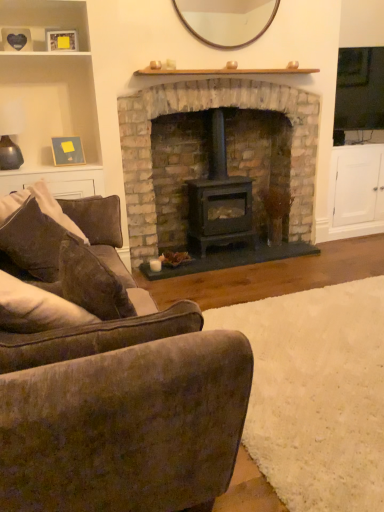
Question: Does velvety brown armchair at lower left have a larger size compared to wooden mirror at upper center?

Choices:
 (A) yes
 (B) no

Answer: (A)

Question: Are velvety brown armchair at lower left and wooden mirror at upper center making contact?

Choices:
 (A) no
 (B) yes

Answer: (A)

Question: Does velvety brown armchair at lower left turn towards wooden mirror at upper center?

Choices:
 (A) yes
 (B) no

Answer: (B)

Question: Would you say velvety brown armchair at lower left is a long distance from wooden mirror at upper center?

Choices:
 (A) no
 (B) yes

Answer: (B)

Question: Can you confirm if velvety brown armchair at lower left is shorter than wooden mirror at upper center?

Choices:
 (A) yes
 (B) no

Answer: (A)

Question: In the image, is brown fabric pillow at left positioned in front of or behind velvety brown armchair at lower left?

Choices:
 (A) behind
 (B) front

Answer: (A)

Question: From a real-world perspective, is brown fabric pillow at left physically located above or below velvety brown armchair at lower left?

Choices:
 (A) above
 (B) below

Answer: (A)

Question: Is brown fabric pillow at left taller or shorter than velvety brown armchair at lower left?

Choices:
 (A) short
 (B) tall

Answer: (B)

Question: Would you say brown fabric pillow at left is to the left or to the right of velvety brown armchair at lower left in the picture?

Choices:
 (A) left
 (B) right

Answer: (A)

Question: In the image, is wooden picture frame at upper left, arranged as the 2th picture frame when viewed from the back, positioned in front of or behind velvety brown armchair at lower left?

Choices:
 (A) behind
 (B) front

Answer: (A)

Question: From a real-world perspective, is wooden picture frame at upper left, arranged as the 2th picture frame when viewed from the back, physically located above or below velvety brown armchair at lower left?

Choices:
 (A) above
 (B) below

Answer: (A)

Question: Is wooden picture frame at upper left, positioned as the 1th picture frame in top-to-bottom order, taller or shorter than velvety brown armchair at lower left?

Choices:
 (A) short
 (B) tall

Answer: (B)

Question: In terms of size, does wooden picture frame at upper left, acting as the 1th picture frame starting from the front, appear bigger or smaller than velvety brown armchair at lower left?

Choices:
 (A) small
 (B) big

Answer: (A)

Question: From a real-world perspective, relative to black matte wood burning stove at center, is velvety brown armchair at lower left vertically above or below?

Choices:
 (A) below
 (B) above

Answer: (A)

Question: From the image's perspective, is velvety brown armchair at lower left located above or below black matte wood burning stove at center?

Choices:
 (A) above
 (B) below

Answer: (B)